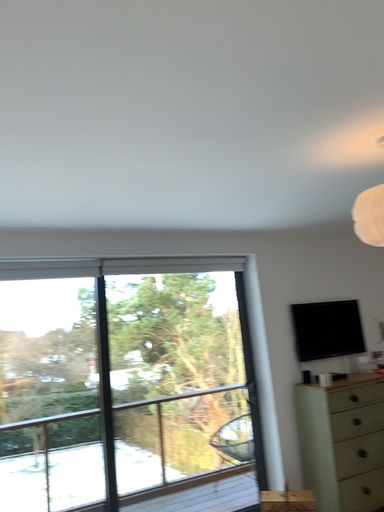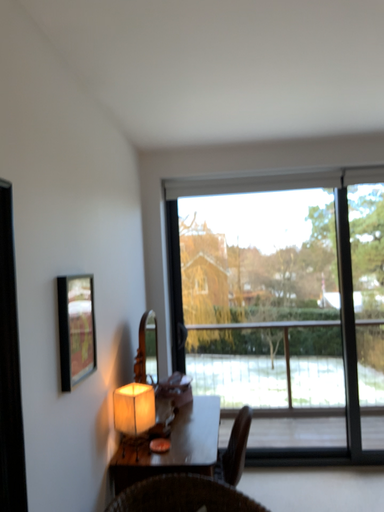
Question: Which way did the camera rotate in the video?

Choices:
 (A) rotated right
 (B) rotated left

Answer: (B)